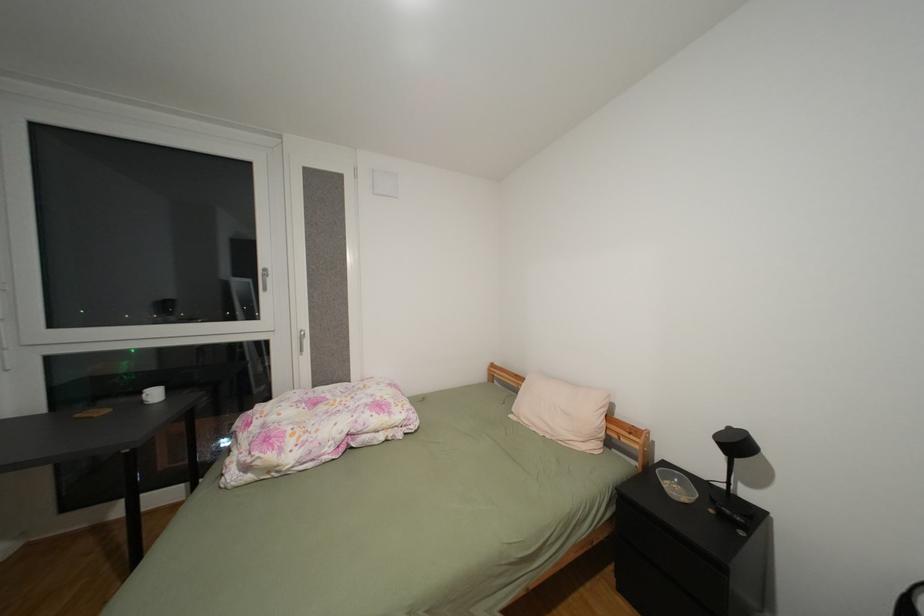
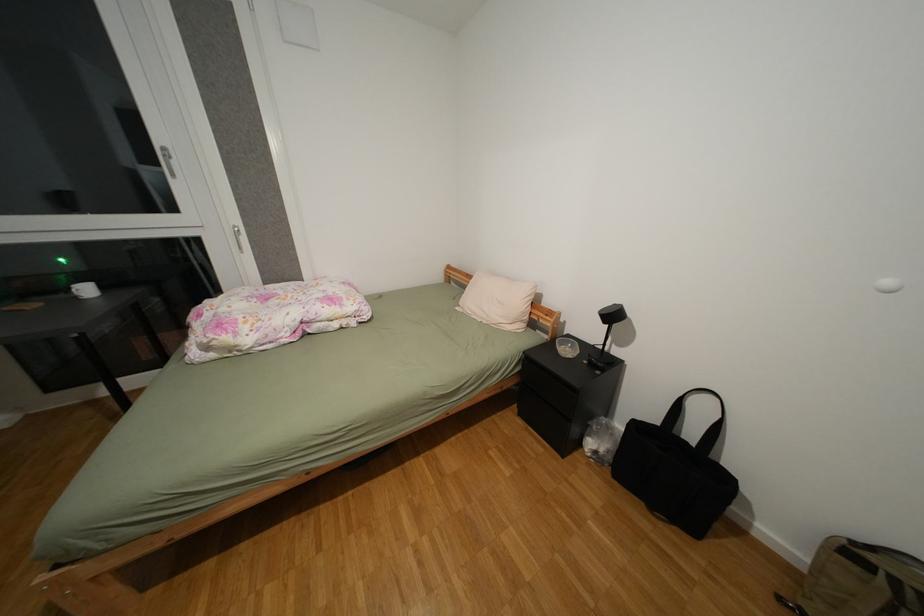
Question: Based on the continuous images, in which direction is the camera rotating? Reply with the corresponding letter.

Choices:
 (A) Left
 (B) Right
 (C) Up
 (D) Down

Answer: (D)